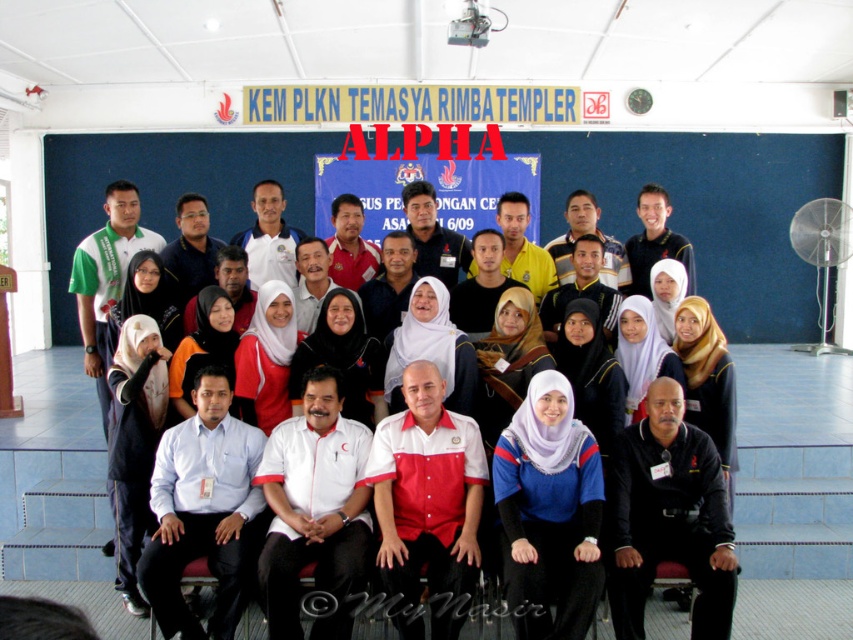
Identify the location of blue jersey at center. (549, 513).

Between point (578, 586) and point (349, 557), which one is positioned behind?

The point (349, 557) is behind.

This screenshot has width=853, height=640. In order to click on blue jersey at center in this screenshot , I will do `click(549, 513)`.

Where is `blue jersey at center`? The height and width of the screenshot is (640, 853). blue jersey at center is located at coordinates (549, 513).

How much distance is there between black matte shirt at lower right and white matte shirt at center?

The distance of black matte shirt at lower right from white matte shirt at center is 1.85 meters.

Can you confirm if black matte shirt at lower right is smaller than white matte shirt at center?

Yes.

Find the location of a particular element. black matte shirt at lower right is located at coordinates (668, 516).

The image size is (853, 640). Find the location of `black matte shirt at lower right`. black matte shirt at lower right is located at coordinates (668, 516).

Is point (184, 452) more distant than point (306, 486)?

Yes, point (184, 452) is behind point (306, 486).

Between light blue shirt at center and white matte shirt at center, which one appears on the right side from the viewer's perspective?

Positioned to the right is white matte shirt at center.

Which is behind, point (167, 540) or point (331, 621)?

Positioned behind is point (167, 540).

Locate an element on the screen. The width and height of the screenshot is (853, 640). light blue shirt at center is located at coordinates (204, 509).